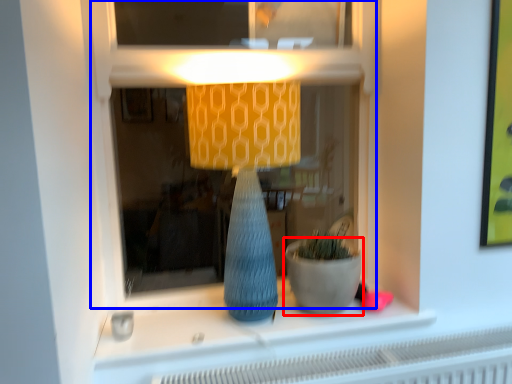
Question: Which of the following is the farthest to the observer, flowerpot (highlighted by a red box) or shop window (highlighted by a blue box)?

Choices:
 (A) flowerpot
 (B) shop window

Answer: (A)